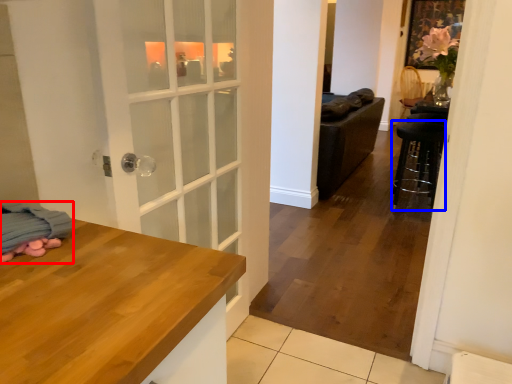
Question: Which of the following is the farthest to the observer, blanket (highlighted by a red box) or bar stool (highlighted by a blue box)?

Choices:
 (A) blanket
 (B) bar stool

Answer: (B)